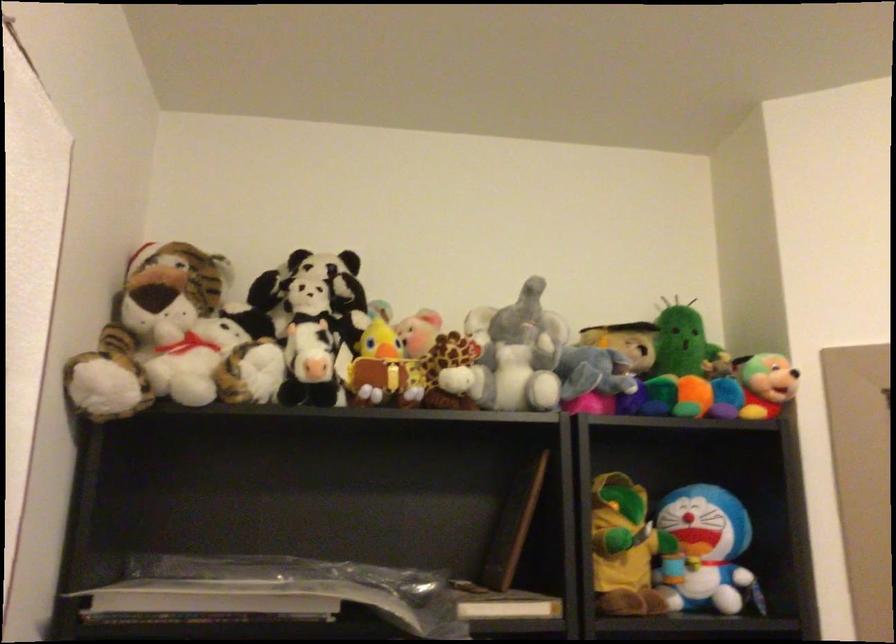
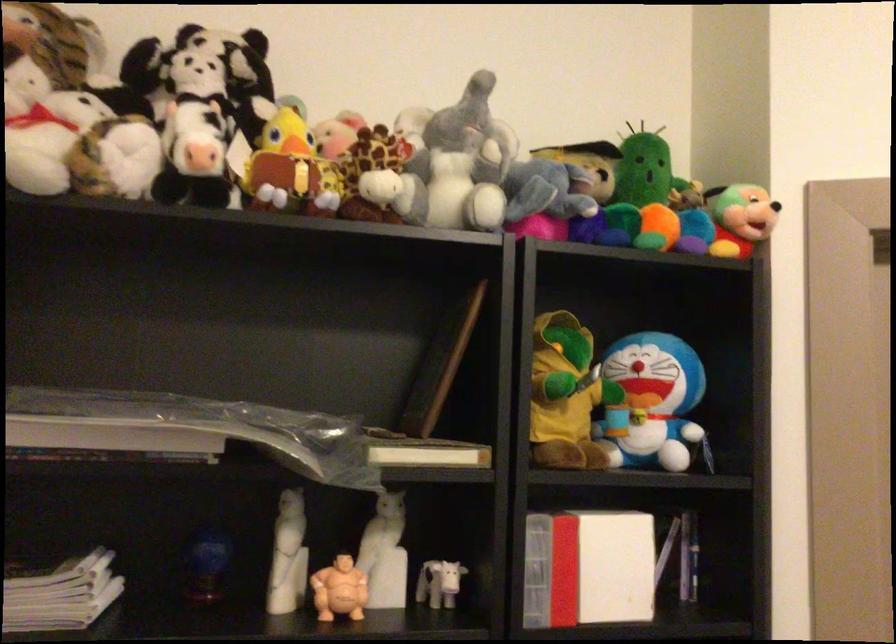
Where in the second image is the point corresponding to point 383,371 from the first image?

(290, 169)